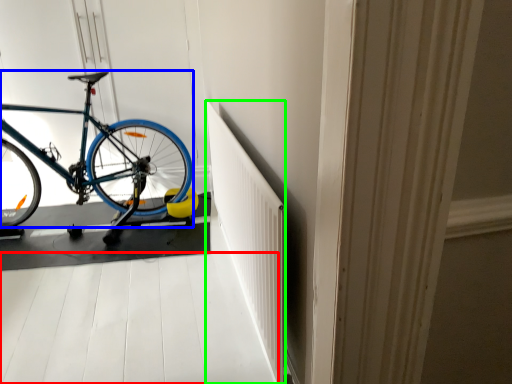
Question: Which object is positioned closest to path (highlighted by a red box)? Select from bicycle (highlighted by a blue box) and radiator (highlighted by a green box).

Choices:
 (A) bicycle
 (B) radiator

Answer: (B)